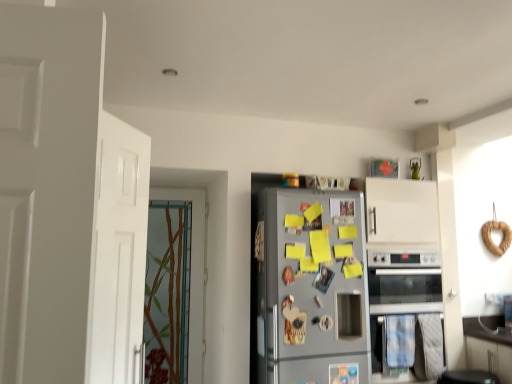
Question: Should I look upward or downward to see satin silver fridge at center?

Choices:
 (A) down
 (B) up

Answer: (A)

Question: Does satin silver oven at lower right have a smaller size compared to white matte door at left, the 2th door from the back?

Choices:
 (A) yes
 (B) no

Answer: (B)

Question: Is satin silver oven at lower right oriented away from white matte door at left, the 2th door from the back?

Choices:
 (A) yes
 (B) no

Answer: (B)

Question: Considering the relative sizes of satin silver oven at lower right and white matte door at left, the 2th door from the back, in the image provided, is satin silver oven at lower right shorter than white matte door at left, the 2th door from the back,?

Choices:
 (A) yes
 (B) no

Answer: (A)

Question: Can you confirm if satin silver oven at lower right is bigger than white matte door at left, marked as the first door in a front-to-back arrangement?

Choices:
 (A) yes
 (B) no

Answer: (A)

Question: Does satin silver oven at lower right appear on the right side of white matte door at left, the 2th door from the back?

Choices:
 (A) no
 (B) yes

Answer: (B)

Question: From a real-world perspective, is satin silver oven at lower right under white matte door at left, marked as the first door in a front-to-back arrangement?

Choices:
 (A) yes
 (B) no

Answer: (A)

Question: Can you confirm if baked wheat bagel at right is shorter than satin silver oven at lower right?

Choices:
 (A) yes
 (B) no

Answer: (A)

Question: Is baked wheat bagel at right turned away from satin silver oven at lower right?

Choices:
 (A) no
 (B) yes

Answer: (A)

Question: Does baked wheat bagel at right have a greater width compared to satin silver oven at lower right?

Choices:
 (A) no
 (B) yes

Answer: (A)

Question: Is baked wheat bagel at right to the right of satin silver oven at lower right from the viewer's perspective?

Choices:
 (A) no
 (B) yes

Answer: (B)

Question: From the image's perspective, is baked wheat bagel at right beneath satin silver oven at lower right?

Choices:
 (A) yes
 (B) no

Answer: (B)

Question: Would you say baked wheat bagel at right contains satin silver oven at lower right?

Choices:
 (A) yes
 (B) no

Answer: (B)

Question: Can you confirm if satin silver fridge at center is taller than satin silver oven at lower right?

Choices:
 (A) no
 (B) yes

Answer: (B)